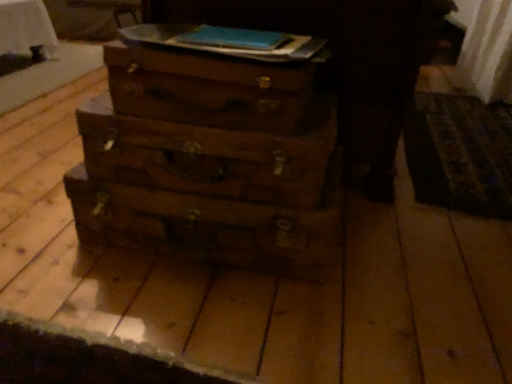
Question: Which direction should I rotate to look at wooden drawer at center, the first drawer when ordered from bottom to top?

Choices:
 (A) right
 (B) left

Answer: (B)

Question: Does wooden chest at center turn towards wooden drawer at center, which is the third drawer in top-to-bottom order?

Choices:
 (A) yes
 (B) no

Answer: (B)

Question: Is wooden chest at center at the left side of wooden drawer at center, the first drawer when ordered from bottom to top?

Choices:
 (A) no
 (B) yes

Answer: (A)

Question: From the image's perspective, would you say wooden chest at center is shown under wooden drawer at center, which is the third drawer in top-to-bottom order?

Choices:
 (A) no
 (B) yes

Answer: (A)

Question: Can you confirm if wooden chest at center is positioned to the right of wooden drawer at center, which is the third drawer in top-to-bottom order?

Choices:
 (A) yes
 (B) no

Answer: (A)

Question: Can you confirm if wooden chest at center is wider than wooden drawer at center, the first drawer when ordered from bottom to top?

Choices:
 (A) yes
 (B) no

Answer: (A)

Question: From a real-world perspective, is wooden chest at center beneath wooden drawer at center, which is the third drawer in top-to-bottom order?

Choices:
 (A) no
 (B) yes

Answer: (A)

Question: Is wooden drawer at center, positioned as the third drawer in bottom-to-top order, positioned far away from wooden chest at center?

Choices:
 (A) yes
 (B) no

Answer: (B)

Question: Does wooden drawer at center, acting as the 1th drawer starting from the top, appear on the right side of wooden chest at center?

Choices:
 (A) no
 (B) yes

Answer: (A)

Question: Does wooden drawer at center, positioned as the third drawer in bottom-to-top order, come behind wooden chest at center?

Choices:
 (A) yes
 (B) no

Answer: (B)

Question: From the image's perspective, does wooden drawer at center, positioned as the third drawer in bottom-to-top order, appear higher than wooden chest at center?

Choices:
 (A) no
 (B) yes

Answer: (A)

Question: Can you confirm if wooden drawer at center, acting as the 1th drawer starting from the top, is bigger than wooden chest at center?

Choices:
 (A) yes
 (B) no

Answer: (B)

Question: Is wooden drawer at center, positioned as the third drawer in bottom-to-top order, wider than wooden chest at center?

Choices:
 (A) no
 (B) yes

Answer: (A)

Question: Is wooden drawer at center, which is the third drawer in top-to-bottom order, not close to wooden drawer at center, arranged as the second drawer when ordered from the bottom?

Choices:
 (A) yes
 (B) no

Answer: (B)